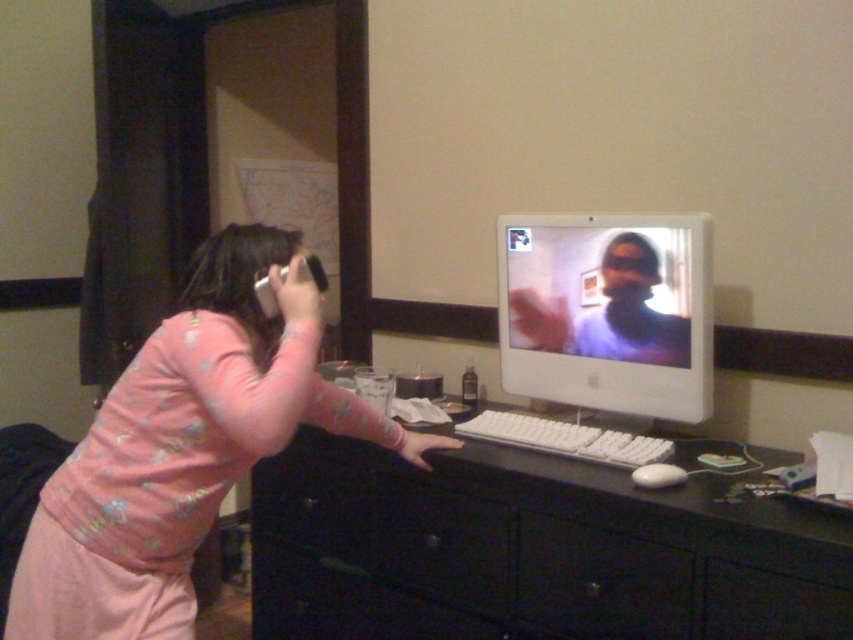
You are setting up a new webcam that requires it to be placed exactly 20 inches away from the white glossy monitor at center. Can you place it on the black plastic drawer at lower center?

The distance between the white glossy monitor at center and the black plastic drawer at lower center is 18.50 inches, which is less than the required 20 inches. Therefore, placing the webcam on the black plastic drawer at lower center would not meet the distance requirement.

You are organizing the desk and need to place a new item between the white glossy monitor at center and the black plastic drawer at lower center. Based on their current positions, where should you place the new item?

The white glossy monitor at center is positioned on the right side of the black plastic drawer at lower center, so you should place the new item between them on the left side of the monitor and the right side of the drawer.

You are trying to locate the pink fabric at left in the image. According to the coordinates provided, where exactly is it positioned?

The pink fabric at left is located at coordinates point (184, 448).